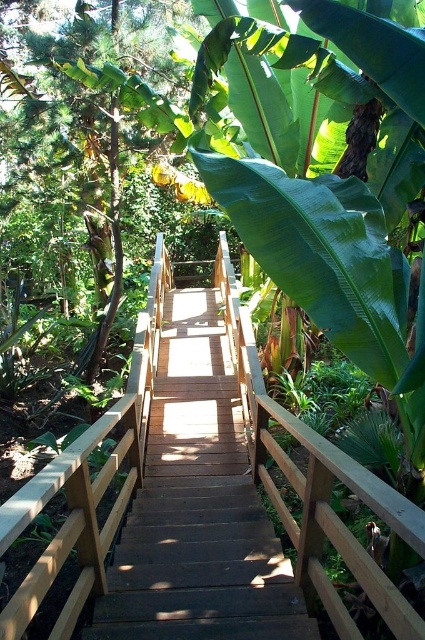
You are standing on the wooden bridge at center and want to go down to the brown wooden stairs at center. Which direction should you move to reach them?

You should move downward to reach the brown wooden stairs at center because it is located below the wooden bridge at center.

You are standing at the bottom of the brown wooden stairs at center. Looking up, what is the 2D coordinate of the point where the stairs begin to ascend?

The 2D coordinate of the point where the brown wooden stairs at center begin to ascend is at point (198, 508).

You are standing at the base of the wooden staircase in the image. If you walk straight ahead, will you eventually reach the point marked by the coordinates point (x=198, y=508)?

Yes, walking straight ahead from the base of the brown wooden stairs at center will lead you to the point marked by point (x=198, y=508) because that point is located on the stairs themselves.